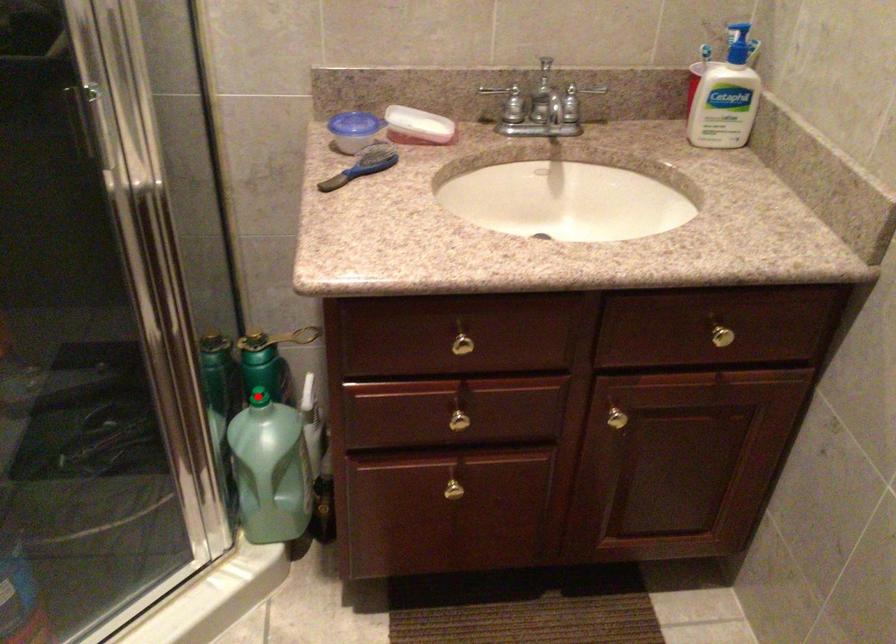
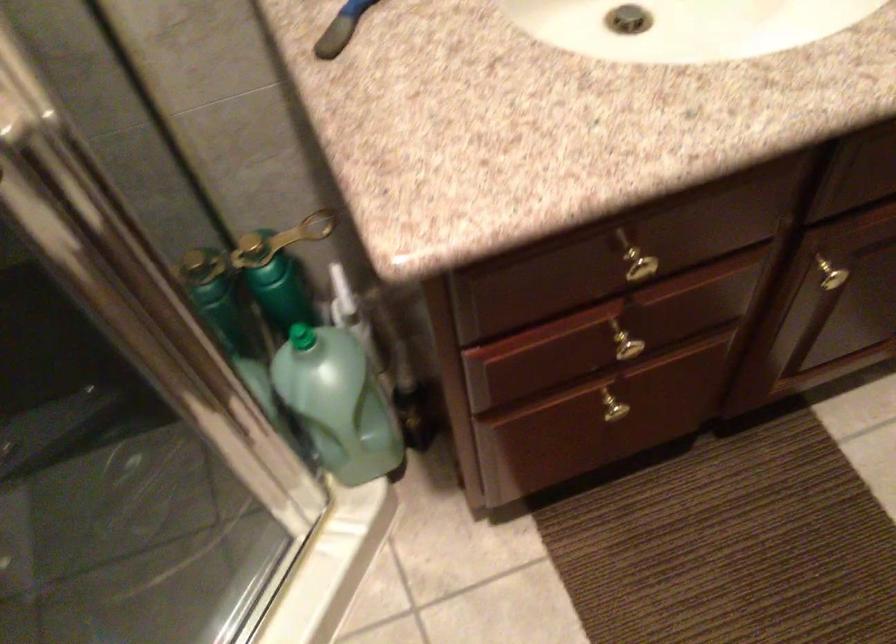
Locate, in the second image, the point that corresponds to the highlighted location in the first image.

(300, 337)